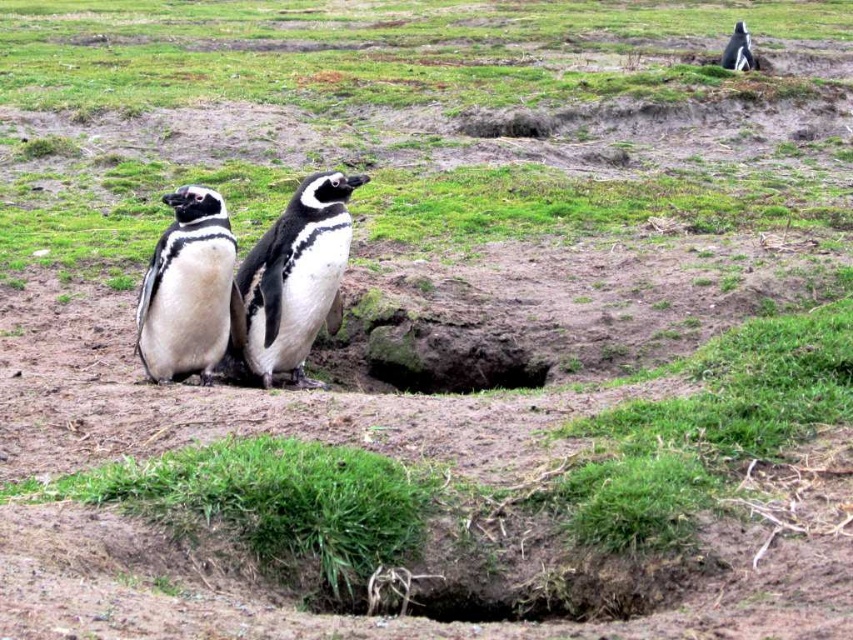
You are a wildlife photographer aiming to capture both the white glossy penguin at center and the black and white feathers at center in a single frame. Given that your camera has a fixed focal length, which penguin should you focus on first to ensure both are in focus?

The white glossy penguin at center is bigger than black and white feathers at center, so focusing on the white glossy penguin at center first will help ensure both are in focus since it is larger and likely closer to the camera.

You are a wildlife photographer aiming to capture a closeup shot of the white glossy penguin at center. Your camera is currently focused on the point at coordinate (294, 278). Is the focus point correctly positioned to capture the penguin?

Yes, the focus point at coordinate (294, 278) is correctly positioned to capture the white glossy penguin at center as indicated by the description.